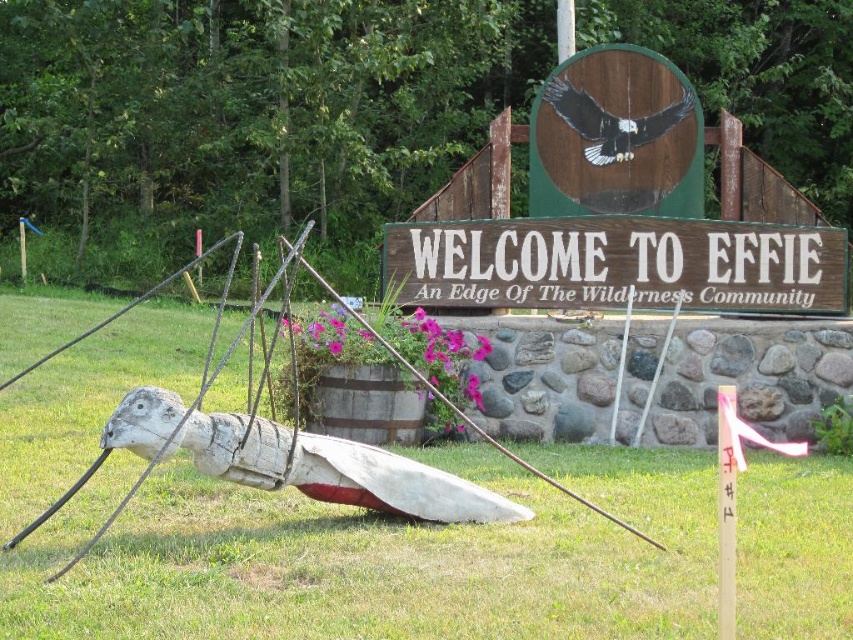
You are standing in front of the wooden bird sculpture at Effie. You notice two points marked on the sculpture. The first point is at coordinate (x=660, y=621) and the second is at (x=682, y=300). Which point is closer to you?

Point (x=660, y=621) is closer to the viewer than point (x=682, y=300).

You are standing at the entrance of Effie and want to place a small flower pot between the green grass at lower center and the wooden sign at center. According to the scene description, where exactly should you place it?

The green grass at lower center is positioned under the wooden sign at center, so you should place the flower pot between them at the lower center area under the wooden sign at center.

You are a visitor arriving at Effie and notice the green grass at lower center and the wooden sign at center. Which object is closer to the ground?

The green grass at lower center is much taller than the wooden sign at center, so the wooden sign at center is closer to the ground.